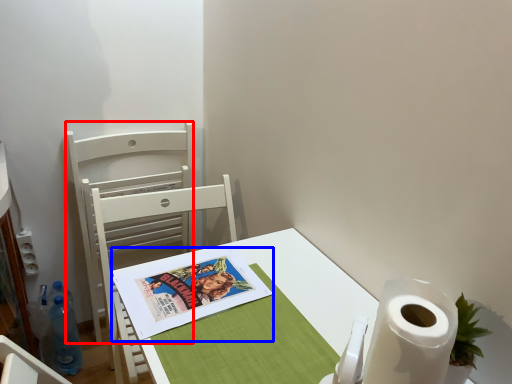
Question: Among these objects, which one is farthest to the camera, chair (highlighted by a red box) or comic book (highlighted by a blue box)?

Choices:
 (A) chair
 (B) comic book

Answer: (A)